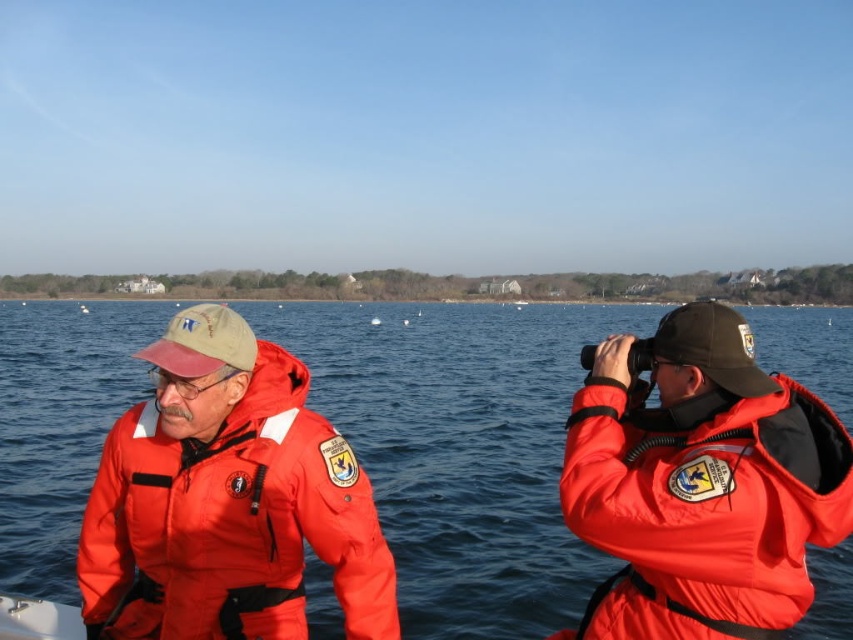
Can you confirm if blue water at center is shorter than matte orange life jacket at left?

No.

Is point (465, 369) behind point (252, 374)?

Yes, it is.

At what (x,y) coordinates should I click in order to perform the action: click on blue water at center. Please return your answer as a coordinate pair (x, y). Image resolution: width=853 pixels, height=640 pixels. Looking at the image, I should click on (461, 449).

Does matte orange life jacket at left appear on the right side of matte orange life jacket at right?

In fact, matte orange life jacket at left is to the left of matte orange life jacket at right.

Can you confirm if matte orange life jacket at left is bigger than matte orange life jacket at right?

Correct, matte orange life jacket at left is larger in size than matte orange life jacket at right.

At what (x,y) coordinates should I click in order to perform the action: click on matte orange life jacket at left. Please return your answer as a coordinate pair (x, y). Looking at the image, I should click on (231, 522).

At what (x,y) coordinates should I click in order to perform the action: click on matte orange life jacket at left. Please return your answer as a coordinate pair (x, y). This screenshot has width=853, height=640. Looking at the image, I should click on (x=231, y=522).

Based on the photo, is blue water at center bigger than matte orange life jacket at right?

Correct, blue water at center is larger in size than matte orange life jacket at right.

Does blue water at center come in front of matte orange life jacket at right?

No, blue water at center is behind matte orange life jacket at right.

Find the location of a particular element. The width and height of the screenshot is (853, 640). blue water at center is located at coordinates (461, 449).